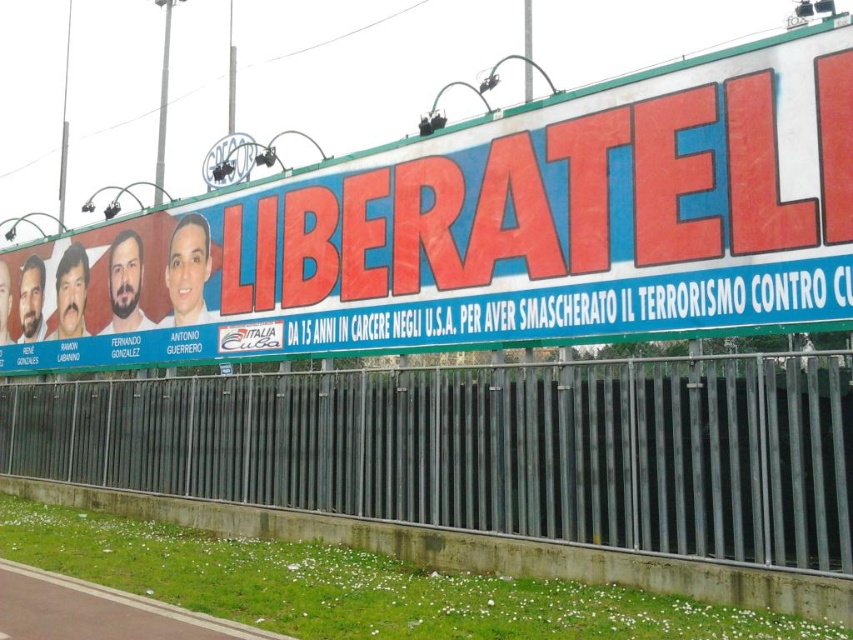
You are standing in front of the billboard and want to touch both points mentioned. Which point should you reach for first, the point at coordinates (277, 346) or the point at (839, 429)?

You should reach for the point at coordinates (277, 346) first because it is closer to you than the point at (839, 429), which is further away.

You are a photographer trying to capture the red plastic billboard at upper center and the metallic gray fence at lower center in a single shot. Can you position yourself so that the billboard is visible above the fence?

Yes, the red plastic billboard at upper center is located above the metallic gray fence at lower center, so positioning yourself appropriately will allow the billboard to be seen above the fence in the photo.